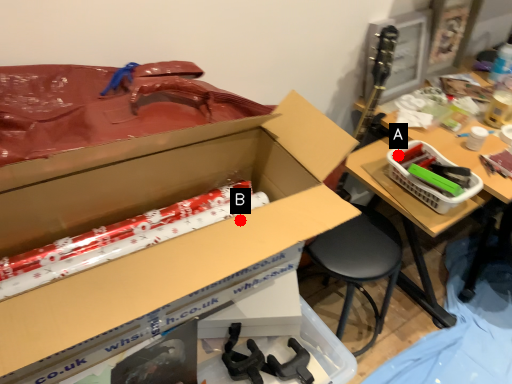
Question: Two points are circled on the image, labeled by A and B beside each circle. Which point appears farthest from the camera in this image?

Choices:
 (A) A is further
 (B) B is further

Answer: (A)